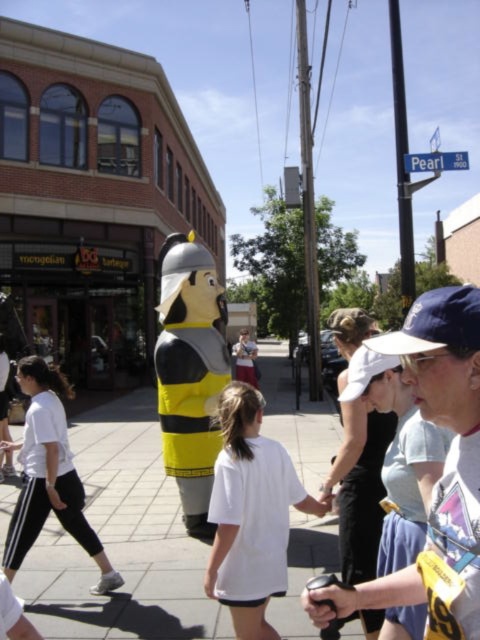
Who is shorter, gray concrete sidewalk at center or yellow and black plush at center?

gray concrete sidewalk at center is shorter.

Can you confirm if gray concrete sidewalk at center is positioned below yellow and black plush at center?

Correct, gray concrete sidewalk at center is located below yellow and black plush at center.

What do you see at coordinates (122, 541) in the screenshot? I see `gray concrete sidewalk at center` at bounding box center [122, 541].

What are the coordinates of `gray concrete sidewalk at center` in the screenshot? It's located at (122, 541).

Between gray concrete sidewalk at center and white cotton shirt at center, which one is positioned lower?

gray concrete sidewalk at center is lower down.

Does gray concrete sidewalk at center appear on the left side of white cotton shirt at center?

Indeed, gray concrete sidewalk at center is positioned on the left side of white cotton shirt at center.

Where is `gray concrete sidewalk at center`? The image size is (480, 640). gray concrete sidewalk at center is located at coordinates (122, 541).

Is white cotton shirt at center bigger than yellow and black plush at center?

Actually, white cotton shirt at center might be smaller than yellow and black plush at center.

Is white cotton shirt at center thinner than yellow and black plush at center?

Yes, white cotton shirt at center is thinner than yellow and black plush at center.

Is point (257, 566) positioned in front of point (206, 282)?

That is True.

This screenshot has height=640, width=480. Find the location of `white cotton shirt at center`. white cotton shirt at center is located at coordinates (251, 515).